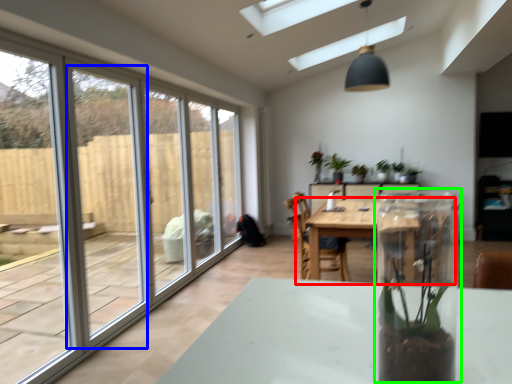
Question: Estimate the real-world distances between objects in this image. Which object is closer to table (highlighted by a red box), screen door (highlighted by a blue box) or glass box (highlighted by a green box)?

Choices:
 (A) screen door
 (B) glass box

Answer: (B)